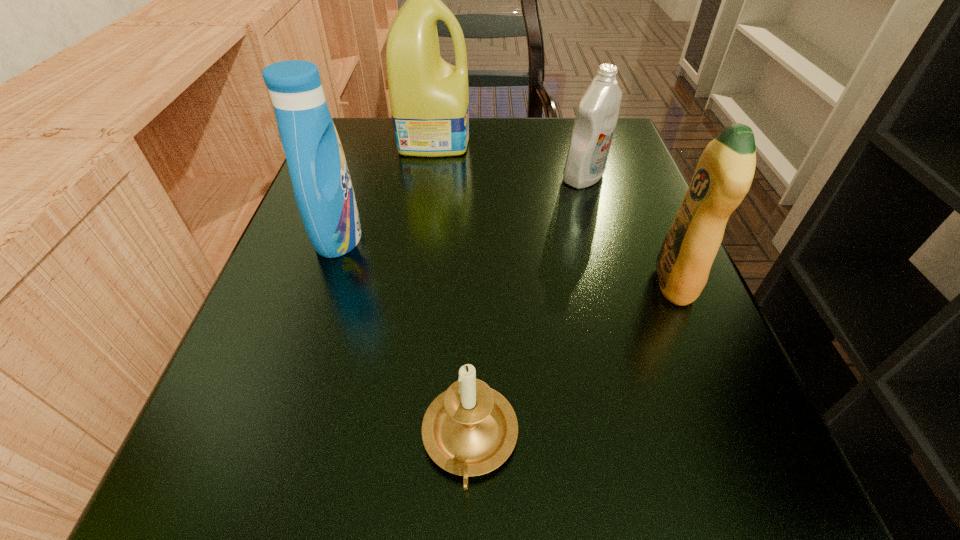
Where is `the farthest object`? the farthest object is located at coordinates (429, 98).

Find the location of a particular element. the farthest detergent is located at coordinates (429, 98).

This screenshot has width=960, height=540. What are the coordinates of `the leftmost detergent` in the screenshot? It's located at (323, 190).

I want to click on the rightmost object, so click(x=724, y=173).

This screenshot has height=540, width=960. Find the location of `the shortest detergent`. the shortest detergent is located at coordinates (596, 118).

Find the location of a particular element. The height and width of the screenshot is (540, 960). the fourth tallest object is located at coordinates (596, 118).

The height and width of the screenshot is (540, 960). I want to click on candle holder, so click(x=470, y=429).

This screenshot has width=960, height=540. I want to click on the shortest object, so point(470,429).

Identify the location of free point located on the label of the third detergent from right to left. This screenshot has height=540, width=960. (564, 139).

The image size is (960, 540). In order to click on vacant region located 0.300m on the front-facing side of the leftmost object in this screenshot , I will do `click(546, 237)`.